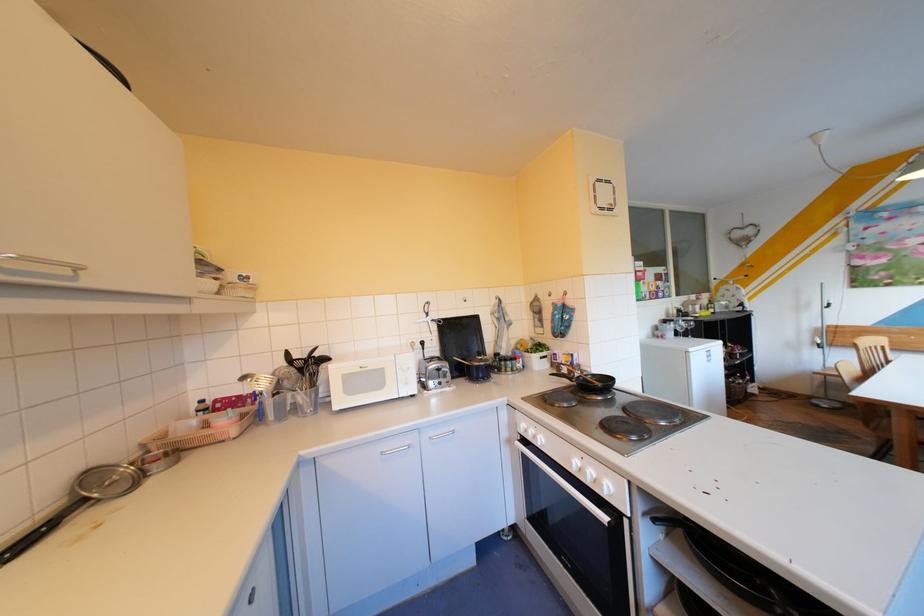
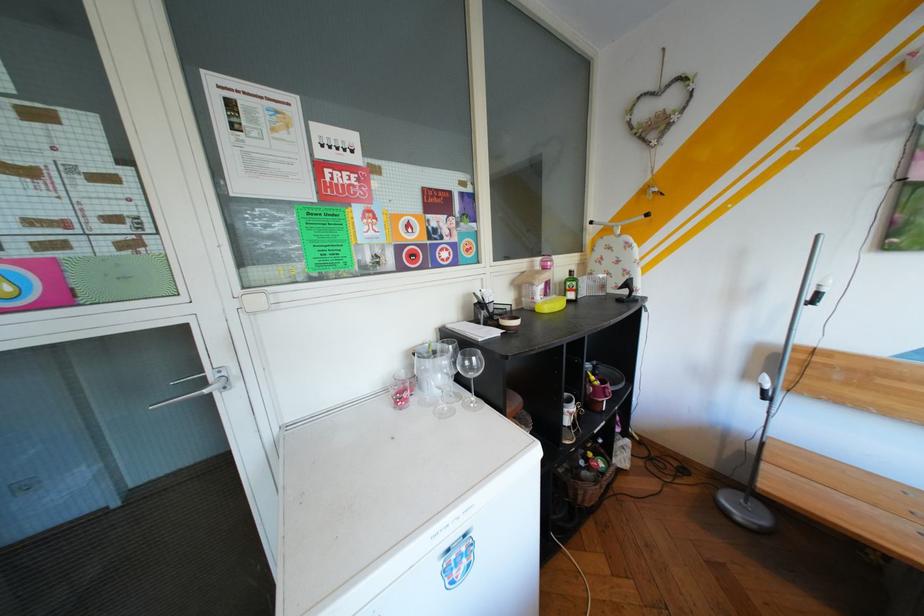
Find the pixel in the second image that matches the point at 708,304 in the first image.

(545, 284)